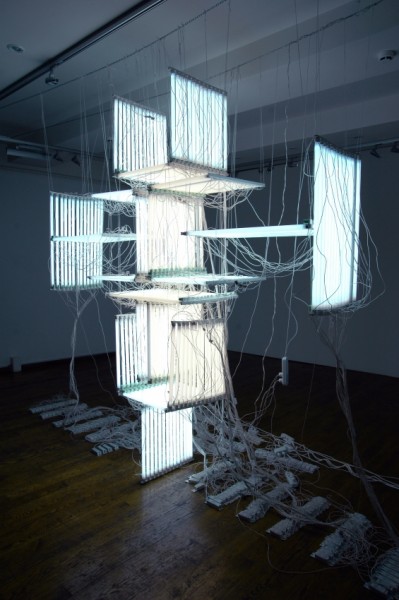
The width and height of the screenshot is (399, 600). What are the coordinates of `electrical cords` in the screenshot? It's located at (222, 200), (121, 270), (266, 349), (269, 401), (243, 434), (229, 445).